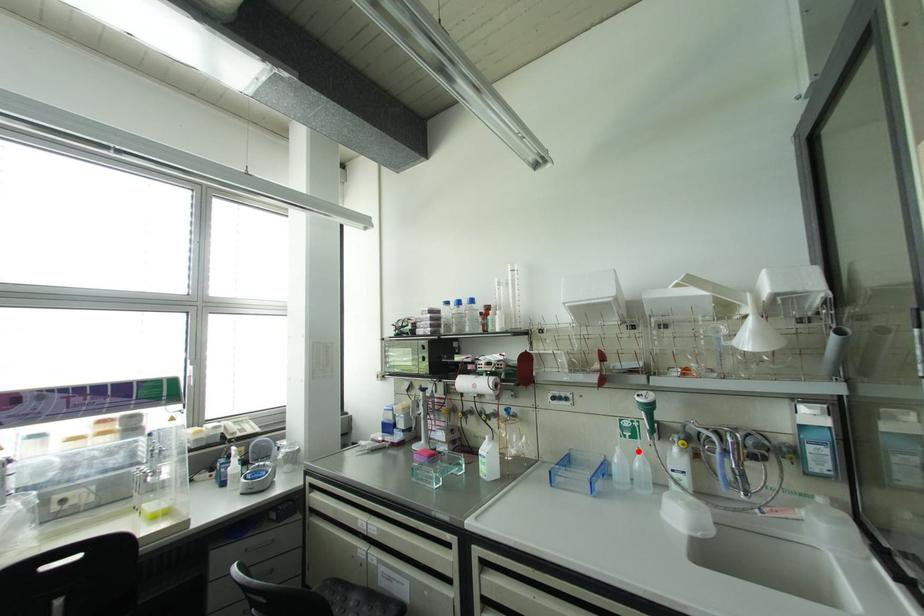
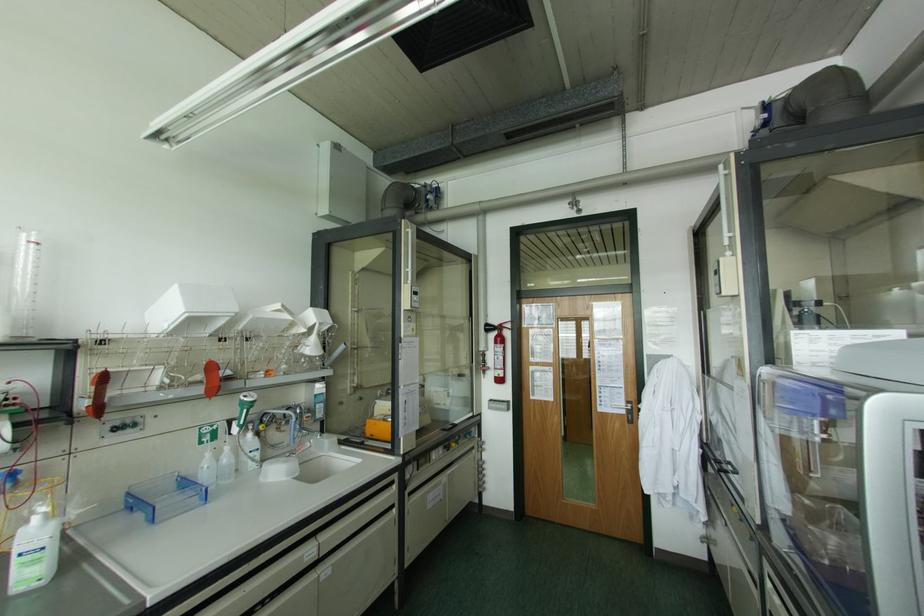
Find the pixel in the second image that matches the highlighted location in the first image.

(226, 448)